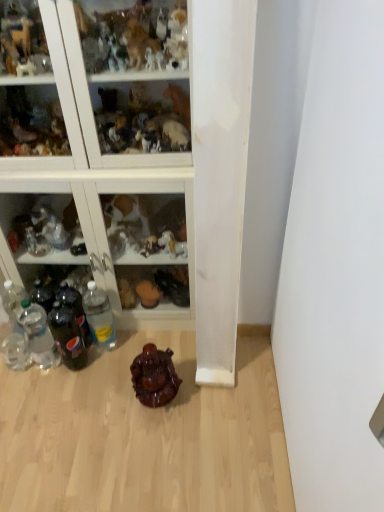
Question: Is shiny brown statue at center to the right of clear plastic bottle at lower left, arranged as the first bottle when viewed from the right, from the viewer's perspective?

Choices:
 (A) yes
 (B) no

Answer: (A)

Question: Considering the relative sizes of shiny brown statue at center and clear plastic bottle at lower left, arranged as the first bottle when viewed from the right, in the image provided, is shiny brown statue at center wider than clear plastic bottle at lower left, arranged as the first bottle when viewed from the right,?

Choices:
 (A) no
 (B) yes

Answer: (B)

Question: Considering the relative sizes of shiny brown statue at center and clear plastic bottle at lower left, arranged as the first bottle when viewed from the right, in the image provided, is shiny brown statue at center thinner than clear plastic bottle at lower left, arranged as the first bottle when viewed from the right,?

Choices:
 (A) yes
 (B) no

Answer: (B)

Question: From a real-world perspective, is shiny brown statue at center positioned over clear plastic bottle at lower left, the fifth bottle viewed from the left, based on gravity?

Choices:
 (A) no
 (B) yes

Answer: (A)

Question: Is shiny brown statue at center completely or partially outside of clear plastic bottle at lower left, the fifth bottle viewed from the left?

Choices:
 (A) no
 (B) yes

Answer: (B)

Question: Can you confirm if shiny brown statue at center is positioned to the left of clear plastic bottle at lower left, the fifth bottle viewed from the left?

Choices:
 (A) no
 (B) yes

Answer: (A)

Question: From the image's perspective, is translucent glass figurines at upper center, the second shelf positioned from the bottom, on clear plastic bottles at left, positioned as the second bottle in left-to-right order?

Choices:
 (A) no
 (B) yes

Answer: (B)

Question: Is the depth of translucent glass figurines at upper center, the second shelf positioned from the bottom, less than that of clear plastic bottles at left, the 4th bottle when ordered from right to left?

Choices:
 (A) yes
 (B) no

Answer: (A)

Question: Is clear plastic bottles at left, positioned as the second bottle in left-to-right order, located within translucent glass figurines at upper center, the first shelf positioned from the top?

Choices:
 (A) no
 (B) yes

Answer: (A)

Question: Is translucent glass figurines at upper center, the first shelf positioned from the top, to the left of clear plastic bottles at left, positioned as the second bottle in left-to-right order, from the viewer's perspective?

Choices:
 (A) yes
 (B) no

Answer: (B)

Question: Does translucent glass figurines at upper center, the first shelf positioned from the top, have a greater height compared to clear plastic bottles at left, the 4th bottle when ordered from right to left?

Choices:
 (A) yes
 (B) no

Answer: (A)

Question: Is translucent glass figurines at upper center, the first shelf positioned from the top, bigger than clear plastic bottles at left, positioned as the second bottle in left-to-right order?

Choices:
 (A) no
 (B) yes

Answer: (B)

Question: Is clear glass bottles at left, the 1th shelf from the bottom, not close to translucent glass figurines at upper center, the second shelf positioned from the bottom?

Choices:
 (A) no
 (B) yes

Answer: (A)